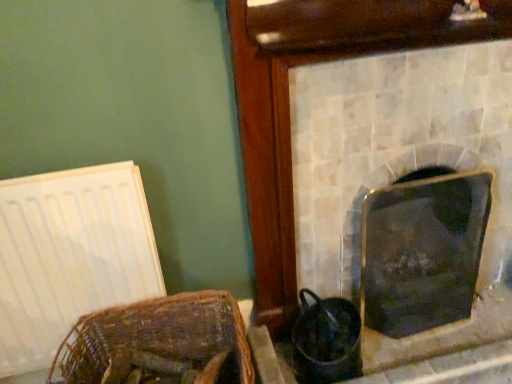
Question: Is white matte radiator at left shorter than shiny black glass at right, the 1th fireplace viewed from the right?

Choices:
 (A) yes
 (B) no

Answer: (B)

Question: Is white matte radiator at left to the right of shiny black glass at right, the 1th fireplace viewed from the right, from the viewer's perspective?

Choices:
 (A) no
 (B) yes

Answer: (A)

Question: Is the depth of white matte radiator at left less than that of shiny black glass at right, the 1th fireplace viewed from the right?

Choices:
 (A) yes
 (B) no

Answer: (A)

Question: Can you see white matte radiator at left touching shiny black glass at right, the 1th fireplace viewed from the right?

Choices:
 (A) yes
 (B) no

Answer: (B)

Question: Is white matte radiator at left to the left of shiny black glass at right, the second fireplace in the left-to-right sequence, from the viewer's perspective?

Choices:
 (A) no
 (B) yes

Answer: (B)

Question: Does white matte radiator at left have a larger size compared to shiny black glass at right, the 1th fireplace viewed from the right?

Choices:
 (A) no
 (B) yes

Answer: (A)

Question: Is white matte radiator at left smaller than woven brown basket at lower left?

Choices:
 (A) no
 (B) yes

Answer: (B)

Question: Is white matte radiator at left turned away from woven brown basket at lower left?

Choices:
 (A) yes
 (B) no

Answer: (B)

Question: Is white matte radiator at left facing towards woven brown basket at lower left?

Choices:
 (A) yes
 (B) no

Answer: (A)

Question: From a real-world perspective, is white matte radiator at left over woven brown basket at lower left?

Choices:
 (A) yes
 (B) no

Answer: (A)

Question: Can you confirm if white matte radiator at left is wider than woven brown basket at lower left?

Choices:
 (A) yes
 (B) no

Answer: (B)

Question: Does white matte radiator at left lie behind woven brown basket at lower left?

Choices:
 (A) yes
 (B) no

Answer: (A)

Question: Can you confirm if shiny black glass at right, the second fireplace in the left-to-right sequence, is shorter than metallic silver fireplace at center, which is the 2th fireplace in right-to-left order?

Choices:
 (A) no
 (B) yes

Answer: (B)